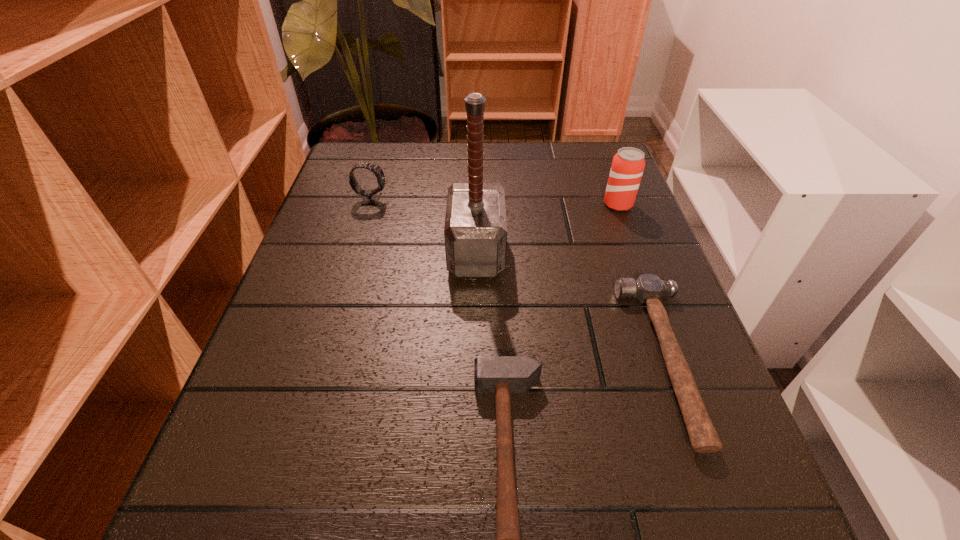
At what (x,y) coordinates should I click in order to perform the action: click on vacant space at the near left corner of the desktop. Please return your answer as a coordinate pair (x, y). The image size is (960, 540). Looking at the image, I should click on (234, 536).

In the image, there is a desktop. At what (x,y) coordinates should I click in order to perform the action: click on vacant space at the far right corner. Please return your answer as a coordinate pair (x, y). The height and width of the screenshot is (540, 960). Looking at the image, I should click on (576, 163).

Image resolution: width=960 pixels, height=540 pixels. I want to click on vacant point located between the farthest hammer and the beer can, so click(x=547, y=228).

This screenshot has width=960, height=540. I want to click on vacant area between the tallest hammer and the beer can, so click(x=547, y=228).

The image size is (960, 540). Find the location of `free space between the farthest hammer and the rightmost hammer`. free space between the farthest hammer and the rightmost hammer is located at coordinates (571, 306).

Locate an element on the screen. This screenshot has height=540, width=960. empty location between the beer can and the tallest object is located at coordinates (547, 228).

Where is `vacant space in between the farthest hammer and the beer can`? The height and width of the screenshot is (540, 960). vacant space in between the farthest hammer and the beer can is located at coordinates (547, 228).

The width and height of the screenshot is (960, 540). I want to click on vacant area that lies between the third tallest object and the rightmost hammer, so tap(519, 279).

Image resolution: width=960 pixels, height=540 pixels. I want to click on vacant area between the third farthest object and the rightmost hammer, so click(571, 306).

Where is `unoccupied area between the tallest hammer and the beer can`? unoccupied area between the tallest hammer and the beer can is located at coordinates (547, 228).